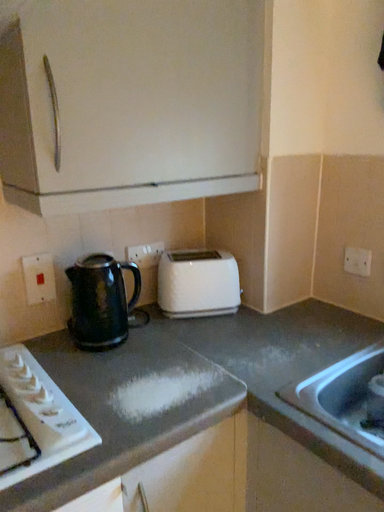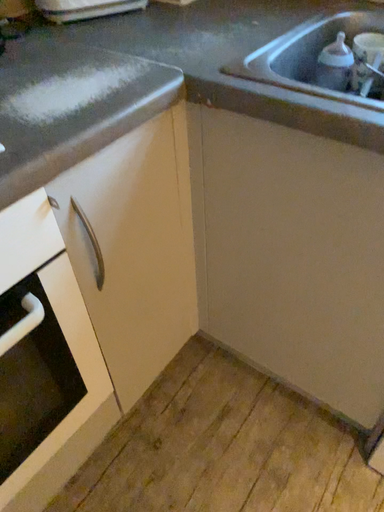
Question: How did the camera likely rotate when shooting the video?

Choices:
 (A) rotated right
 (B) rotated left

Answer: (A)